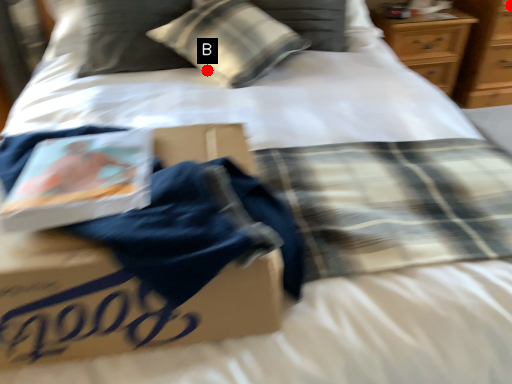
Question: Two points are circled on the image, labeled by A and B beside each circle. Which of the following is the farthest from the observer?

Choices:
 (A) A is further
 (B) B is further

Answer: (A)